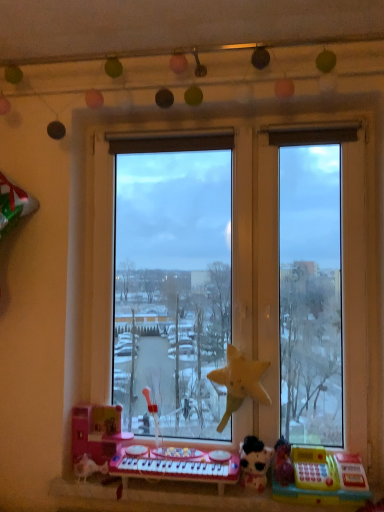
Locate an element on the screen. The image size is (384, 512). white plush cat at lower right, which is the 2th toy from right to left is located at coordinates (254, 463).

Describe the element at coordinates (254, 463) in the screenshot. I see `white plush cat at lower right, which is the 2th toy from right to left` at that location.

Image resolution: width=384 pixels, height=512 pixels. In order to click on pink plastic toy at lower left, placed as the 1th toy when sorted from left to right in this screenshot , I will do `click(96, 438)`.

Image resolution: width=384 pixels, height=512 pixels. What are the coordinates of `pink plastic musical keyboard at lower center` in the screenshot? It's located at (176, 465).

Describe the element at coordinates (176, 465) in the screenshot. The height and width of the screenshot is (512, 384). I see `pink plastic musical keyboard at lower center` at that location.

This screenshot has height=512, width=384. Describe the element at coordinates (240, 382) in the screenshot. I see `yellow matte star at center, the 3th toy positioned from the right` at that location.

This screenshot has height=512, width=384. I want to click on white plush cat at lower right, which is counted as the third toy, starting from the left, so click(254, 463).

You are a GUI agent. You are given a task and a screenshot of the screen. Output one action in this format:
    pyautogui.click(x=<x>, y=<y>)
    Task: Click on the window sill below the transparent glass window at center (from the image's perspective)
    Image resolution: width=384 pixels, height=512 pixels.
    Given the screenshot: What is the action you would take?
    pyautogui.click(x=175, y=496)

Looking at their sizes, would you say plastic toy keyboard at lower center is wider or thinner than transparent glass window at center?

plastic toy keyboard at lower center is wider than transparent glass window at center.

From the image's perspective, is plastic toy keyboard at lower center beneath transparent glass window at center?

Indeed, from the image's perspective, plastic toy keyboard at lower center is shown beneath transparent glass window at center.

Which is in front, point (298, 508) or point (254, 231)?

Point (298, 508)

Can you confirm if pink plastic toy at lower left, the fourth toy when ordered from right to left, is smaller than yellow plastic cash register at lower right, positioned as the fourth toy in left-to-right order?

Yes, pink plastic toy at lower left, the fourth toy when ordered from right to left, is smaller than yellow plastic cash register at lower right, positioned as the fourth toy in left-to-right order.

Can you confirm if pink plastic toy at lower left, the fourth toy when ordered from right to left, is positioned to the left of yellow plastic cash register at lower right, positioned as the fourth toy in left-to-right order?

Indeed, pink plastic toy at lower left, the fourth toy when ordered from right to left, is positioned on the left side of yellow plastic cash register at lower right, positioned as the fourth toy in left-to-right order.

Considering the sizes of objects pink plastic toy at lower left, the fourth toy when ordered from right to left, and yellow plastic cash register at lower right, placed as the first toy when sorted from right to left, in the image provided, who is shorter, pink plastic toy at lower left, the fourth toy when ordered from right to left, or yellow plastic cash register at lower right, placed as the first toy when sorted from right to left,?

yellow plastic cash register at lower right, placed as the first toy when sorted from right to left.

Do you think pink plastic toy at lower left, placed as the 1th toy when sorted from left to right, is within yellow plastic cash register at lower right, placed as the first toy when sorted from right to left, or outside of it?

pink plastic toy at lower left, placed as the 1th toy when sorted from left to right, lies outside yellow plastic cash register at lower right, placed as the first toy when sorted from right to left.

Considering the relative sizes of pink plastic musical keyboard at lower center and plastic toy keyboard at lower center in the image provided, is pink plastic musical keyboard at lower center taller than plastic toy keyboard at lower center?

Yes.

Is pink plastic musical keyboard at lower center facing towards plastic toy keyboard at lower center?

No, pink plastic musical keyboard at lower center is not oriented towards plastic toy keyboard at lower center.

Would you say pink plastic musical keyboard at lower center is to the left or to the right of plastic toy keyboard at lower center in the picture?

Based on their positions, pink plastic musical keyboard at lower center is located to the left of plastic toy keyboard at lower center.

Can we say pink plastic musical keyboard at lower center lies outside plastic toy keyboard at lower center?

Absolutely, pink plastic musical keyboard at lower center is external to plastic toy keyboard at lower center.

Considering the sizes of objects plastic toy keyboard at lower center and pink plastic musical keyboard at lower center in the image provided, who is thinner, plastic toy keyboard at lower center or pink plastic musical keyboard at lower center?

plastic toy keyboard at lower center is thinner.

Is plastic toy keyboard at lower center at the right side of pink plastic musical keyboard at lower center?

Correct, you'll find plastic toy keyboard at lower center to the right of pink plastic musical keyboard at lower center.

Between point (185, 499) and point (159, 466), which one is positioned behind?

The point (159, 466) is farther.

In the image, there is a pink plastic musical keyboard at lower center. In order to click on window sill below it (from a real-world perspective) in this screenshot , I will do `click(175, 496)`.

From the image's perspective, is yellow matte star at center, the 2th toy when ordered from left to right, located beneath yellow plastic cash register at lower right, placed as the first toy when sorted from right to left?

No.

From a real-world perspective, which is physically above, yellow matte star at center, the 3th toy positioned from the right, or yellow plastic cash register at lower right, placed as the first toy when sorted from right to left?

yellow matte star at center, the 3th toy positioned from the right.

Considering the relative positions of yellow matte star at center, the 2th toy when ordered from left to right, and yellow plastic cash register at lower right, placed as the first toy when sorted from right to left, in the image provided, is yellow matte star at center, the 2th toy when ordered from left to right, to the left of yellow plastic cash register at lower right, placed as the first toy when sorted from right to left, from the viewer's perspective?

Yes, yellow matte star at center, the 2th toy when ordered from left to right, is to the left of yellow plastic cash register at lower right, placed as the first toy when sorted from right to left.

From a real-world perspective, which object rests below the other?

yellow plastic cash register at lower right, positioned as the fourth toy in left-to-right order, is physically lower.

Is yellow plastic cash register at lower right, placed as the first toy when sorted from right to left, taller or shorter than yellow matte star at center, the 3th toy positioned from the right?

Considering their sizes, yellow plastic cash register at lower right, placed as the first toy when sorted from right to left, has less height than yellow matte star at center, the 3th toy positioned from the right.

From the image's perspective, is yellow plastic cash register at lower right, positioned as the fourth toy in left-to-right order, over yellow matte star at center, the 3th toy positioned from the right?

No, from the image's perspective, yellow plastic cash register at lower right, positioned as the fourth toy in left-to-right order, is not over yellow matte star at center, the 3th toy positioned from the right.

Is plastic toy keyboard at lower center in contact with white plush cat at lower right, which is the 2th toy from right to left?

plastic toy keyboard at lower center is not next to white plush cat at lower right, which is the 2th toy from right to left, and they're not touching.

Is white plush cat at lower right, which is the 2th toy from right to left, located within plastic toy keyboard at lower center?

No, white plush cat at lower right, which is the 2th toy from right to left, is not surrounded by plastic toy keyboard at lower center.

Is plastic toy keyboard at lower center looking in the opposite direction of white plush cat at lower right, which is the 2th toy from right to left?

plastic toy keyboard at lower center is not turned away from white plush cat at lower right, which is the 2th toy from right to left.

Find the location of `window that appears above the plastic toy keyboard at lower center (from the image's perspective)`. window that appears above the plastic toy keyboard at lower center (from the image's perspective) is located at coordinates (232, 244).

Locate an element on the screen. the 3rd toy to the right when counting from the pink plastic toy at lower left, the fourth toy when ordered from right to left is located at coordinates (323, 479).

When comparing their distances from yellow plastic cash register at lower right, placed as the first toy when sorted from right to left, does transparent glass window at center or pink plastic toy at lower left, the fourth toy when ordered from right to left, seem closer?

The object closer to yellow plastic cash register at lower right, placed as the first toy when sorted from right to left, is transparent glass window at center.

Looking at this image, when comparing their distances from white plush cat at lower right, which is the 2th toy from right to left, does yellow plastic cash register at lower right, placed as the first toy when sorted from right to left, or pink plastic musical keyboard at lower center seem further?

pink plastic musical keyboard at lower center lies further to white plush cat at lower right, which is the 2th toy from right to left, than the other object.

From the image, which object appears to be nearer to pink plastic toy at lower left, placed as the 1th toy when sorted from left to right, yellow plastic cash register at lower right, positioned as the fourth toy in left-to-right order, or transparent glass window at center?

transparent glass window at center is positioned closer to the anchor pink plastic toy at lower left, placed as the 1th toy when sorted from left to right.

Based on their spatial positions, is white plush cat at lower right, which is counted as the third toy, starting from the left, or plastic toy keyboard at lower center closer to pink plastic musical keyboard at lower center?

plastic toy keyboard at lower center lies closer to pink plastic musical keyboard at lower center than the other object.

When comparing their distances from pink plastic toy at lower left, the fourth toy when ordered from right to left, does pink plastic musical keyboard at lower center or plastic toy keyboard at lower center seem closer?

Among the two, pink plastic musical keyboard at lower center is located nearer to pink plastic toy at lower left, the fourth toy when ordered from right to left.

Based on their spatial positions, is white plush cat at lower right, which is counted as the third toy, starting from the left, or pink plastic musical keyboard at lower center closer to pink plastic toy at lower left, placed as the 1th toy when sorted from left to right?

pink plastic musical keyboard at lower center lies closer to pink plastic toy at lower left, placed as the 1th toy when sorted from left to right, than the other object.

Considering their positions, is plastic toy keyboard at lower center positioned further to pink plastic toy at lower left, placed as the 1th toy when sorted from left to right, than yellow plastic cash register at lower right, placed as the first toy when sorted from right to left?

Based on the image, yellow plastic cash register at lower right, placed as the first toy when sorted from right to left, appears to be further to pink plastic toy at lower left, placed as the 1th toy when sorted from left to right.

From the image, which object appears to be farther from yellow matte star at center, the 3th toy positioned from the right, transparent glass window at center or plastic toy keyboard at lower center?

The object further to yellow matte star at center, the 3th toy positioned from the right, is plastic toy keyboard at lower center.

I want to click on window sill between pink plastic toy at lower left, placed as the 1th toy when sorted from left to right, and white plush cat at lower right, which is counted as the third toy, starting from the left, from left to right, so 175,496.

Find the location of a particular element. The image size is (384, 512). window sill between pink plastic musical keyboard at lower center and white plush cat at lower right, which is counted as the third toy, starting from the left, in the horizontal direction is located at coordinates (175, 496).

You are a GUI agent. You are given a task and a screenshot of the screen. Output one action in this format:
    pyautogui.click(x=<x>, y=<y>)
    Task: Click on the window sill between pink plastic toy at lower left, placed as the 1th toy when sorted from left to right, and yellow plastic cash register at lower right, placed as the first toy when sorted from right to left, from left to right
    Image resolution: width=384 pixels, height=512 pixels.
    Given the screenshot: What is the action you would take?
    pyautogui.click(x=175, y=496)

Identify the location of musical keyboard between transparent glass window at center and plastic toy keyboard at lower center in the vertical direction. The height and width of the screenshot is (512, 384). (176, 465).